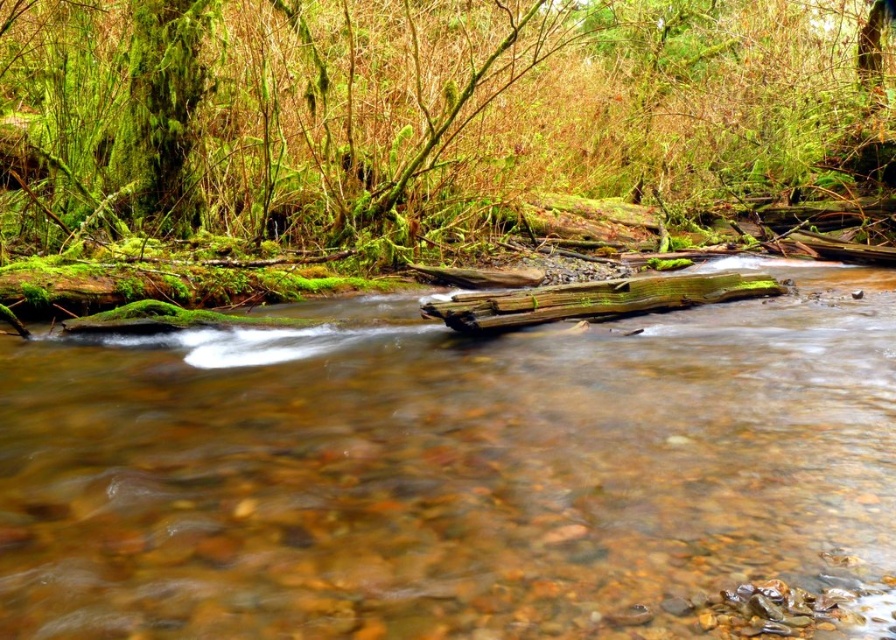
Question: Which point appears closest to the camera in this image?

Choices:
 (A) (866, 358)
 (B) (450, 323)

Answer: (A)

Question: Which of these objects is positioned closest to the green mossy log at upper center?

Choices:
 (A) clear water at center
 (B) green mossy log at center

Answer: (B)

Question: Does clear water at center have a lesser width compared to green mossy log at upper center?

Choices:
 (A) yes
 (B) no

Answer: (A)

Question: Is clear water at center below green mossy log at upper center?

Choices:
 (A) yes
 (B) no

Answer: (A)

Question: Where is green mossy log at upper center located in relation to green mossy log at center in the image?

Choices:
 (A) above
 (B) below

Answer: (A)

Question: Considering the real-world distances, which object is closest to the green mossy log at upper center?

Choices:
 (A) clear water at center
 (B) green mossy log at center

Answer: (B)